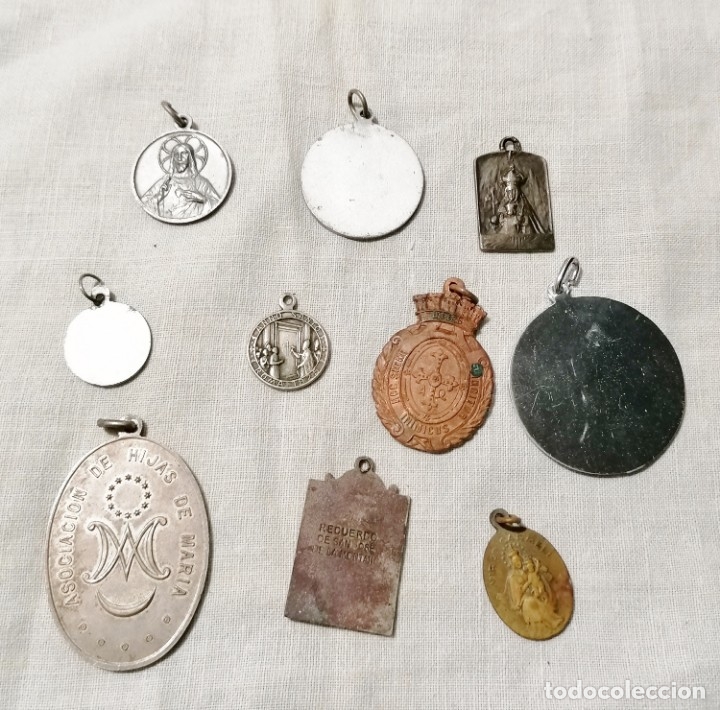
You are a GUI agent. You are given a task and a screenshot of the screen. Output one action in this format:
    pyautogui.click(x=<x>, y=<y>)
    Task: Click on the medallions
    This screenshot has width=720, height=710.
    Given the screenshot: What is the action you would take?
    point(186,173), point(126,349), point(121,525), point(289,346), point(369,182), point(531,204), point(454,385), point(567,390), point(364,529), point(523,572)